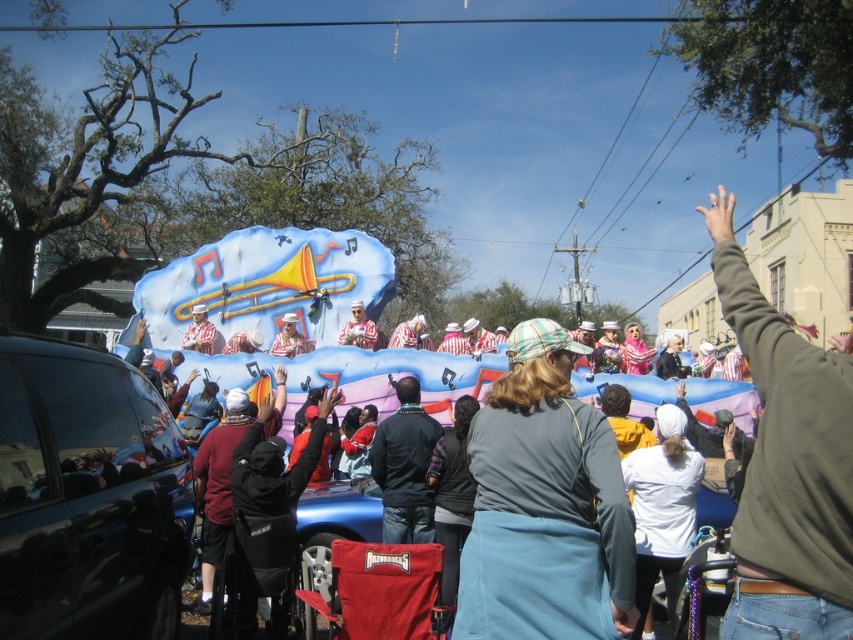
Question: Which object is closer to the camera taking this photo?

Choices:
 (A) green matte shirt at upper right
 (B) striped fabric hat at center

Answer: (A)

Question: Which object appears farthest from the camera in this image?

Choices:
 (A) green matte shirt at upper right
 (B) dark blue jacket at center
 (C) gray fabric hat at center
 (D) matte red clown mask at center

Answer: (D)

Question: Where is white matte jacket at center located in relation to matte white hat at center in the image?

Choices:
 (A) below
 (B) above

Answer: (A)

Question: Based on their relative distances, which object is farther from the shiny black car at lower left?

Choices:
 (A) gray fabric hat at center
 (B) matte red clown mask at center
 (C) white matte jacket at center

Answer: (B)

Question: From the image, what is the correct spatial relationship of shiny black car at lower left in relation to dark blue jacket at center?

Choices:
 (A) left
 (B) right

Answer: (A)

Question: Is green matte shirt at upper right to the right of matte gold trumpet at center from the viewer's perspective?

Choices:
 (A) no
 (B) yes

Answer: (B)